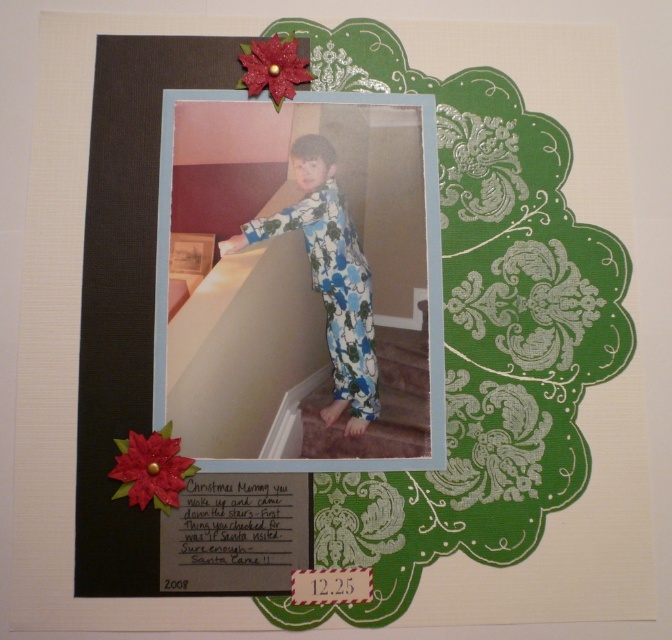
Question: Considering the relative positions of carpeted stairs at center and glittery red flower at upper left in the image provided, where is carpeted stairs at center located with respect to glittery red flower at upper left?

Choices:
 (A) right
 (B) left

Answer: (A)

Question: Among these points, which one is farthest from the camera?

Choices:
 (A) (142, 438)
 (B) (276, 76)
 (C) (392, 364)
 (D) (312, 148)

Answer: (D)

Question: Is floral pajamas at center wider than glittery red flower at upper left?

Choices:
 (A) yes
 (B) no

Answer: (A)

Question: Which point is closer to the camera?

Choices:
 (A) (126, 461)
 (B) (282, 90)

Answer: (A)

Question: Which object is farther from the camera taking this photo?

Choices:
 (A) floral pajamas at center
 (B) carpeted stairs at center
 (C) glittery red flower at upper left

Answer: (A)

Question: Is floral pajamas at center bigger than glittery red flower at upper left?

Choices:
 (A) yes
 (B) no

Answer: (A)